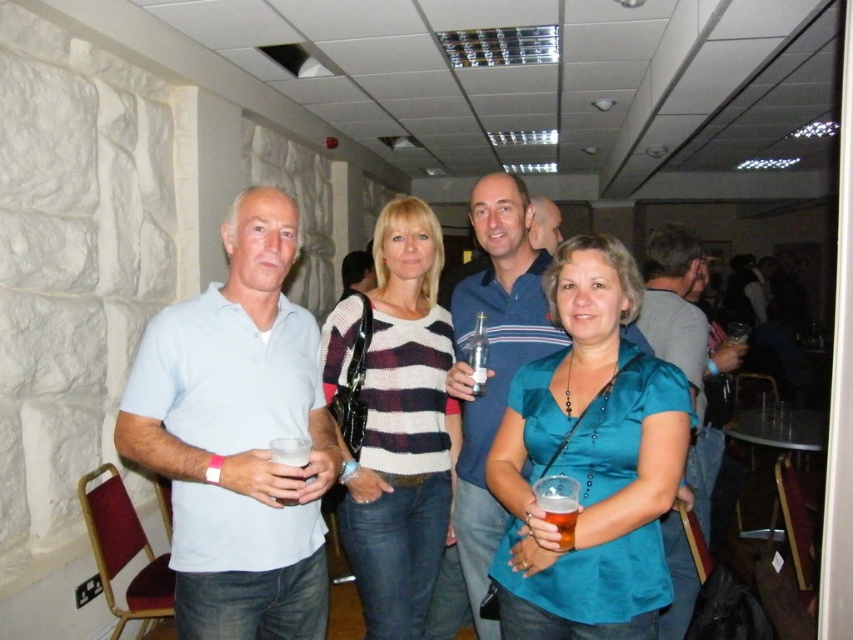
Measure the distance between translucent plastic cup at center and clear plastic cup at center.

A distance of 16.41 inches exists between translucent plastic cup at center and clear plastic cup at center.

Does point (541, 484) come closer to viewer compared to point (276, 452)?

No, it is not.

Who is more forward, (544, 497) or (283, 460)?

Positioned in front is point (283, 460).

The width and height of the screenshot is (853, 640). Find the location of `translucent plastic cup at center`. translucent plastic cup at center is located at coordinates (560, 512).

Which is below, matte blue shirt at center or clear glass bottle at center?

Positioned lower is matte blue shirt at center.

Which is more to the left, matte blue shirt at center or clear glass bottle at center?

clear glass bottle at center

Which is in front, point (645, 273) or point (477, 362)?

Positioned in front is point (477, 362).

Locate an element on the screen. This screenshot has height=640, width=853. matte blue shirt at center is located at coordinates (685, 346).

Between point (281, 259) and point (282, 502), which one is positioned behind?

Positioned behind is point (281, 259).

Is point (260, 225) less distant than point (286, 500)?

No, it is not.

Measure the distance between point (180,412) and camera.

5.18 feet

Locate an element on the screen. The width and height of the screenshot is (853, 640). light blue polo shirt at left is located at coordinates (238, 436).